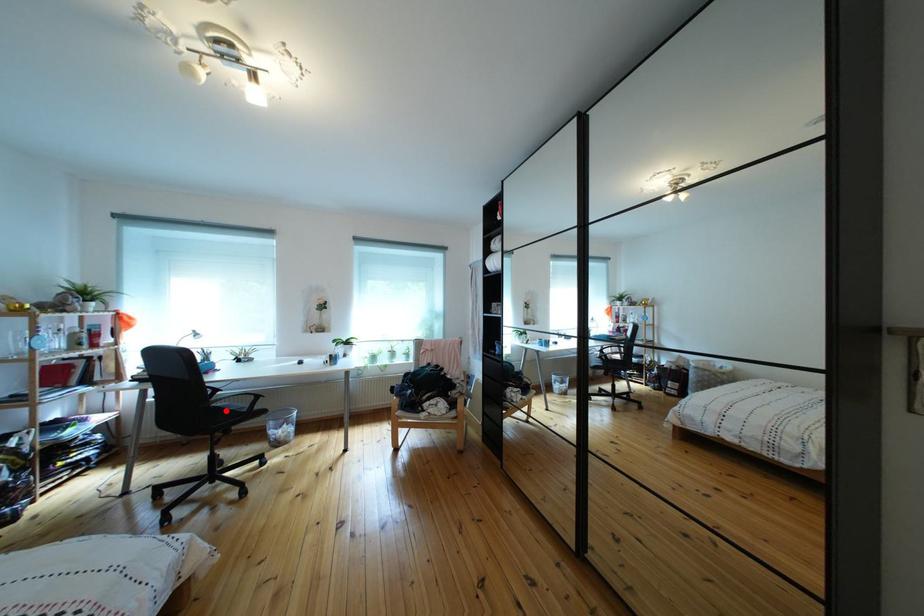
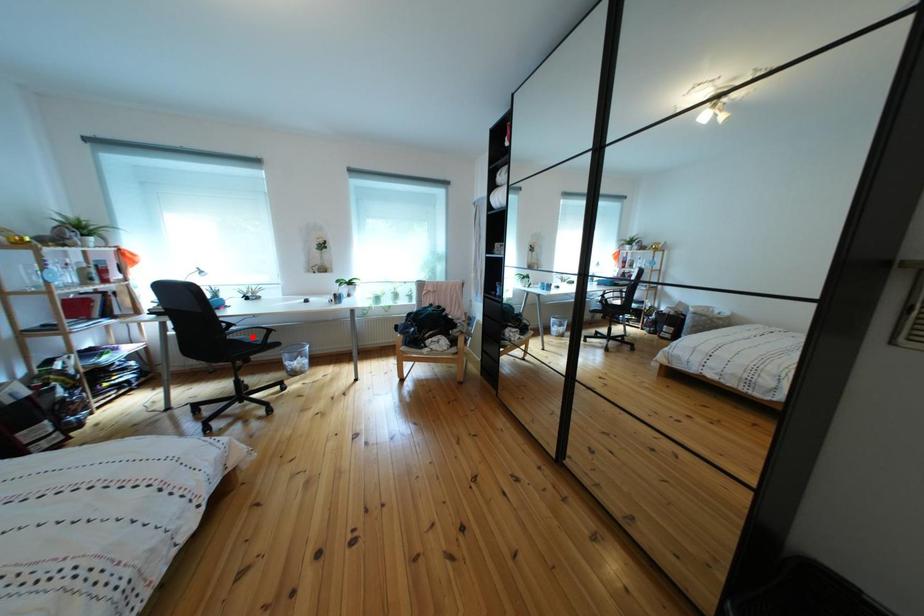
I am providing you with two images of the same scene from different viewpoints. A red point is marked on the first image and another point is marked on the second image. Does the point marked in image1 correspond to the same location as the one in image2?

No